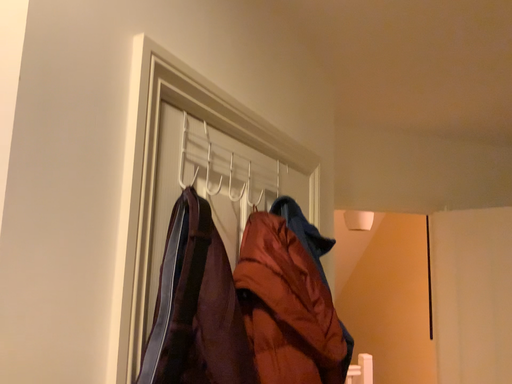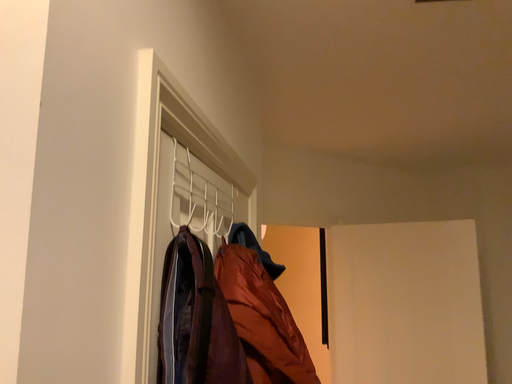
Question: How did the camera likely rotate when shooting the video?

Choices:
 (A) rotated left
 (B) rotated right

Answer: (B)